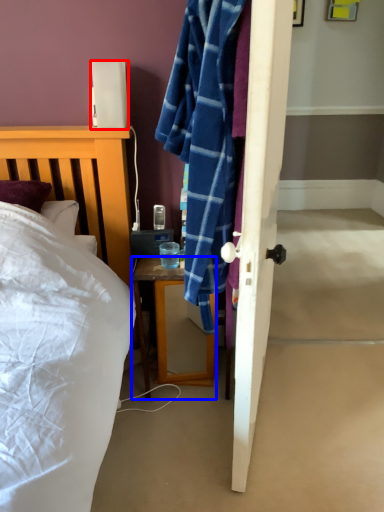
Question: Which of the following is the closest to the observer, lamp (highlighted by a red box) or desk (highlighted by a blue box)?

Choices:
 (A) lamp
 (B) desk

Answer: (A)